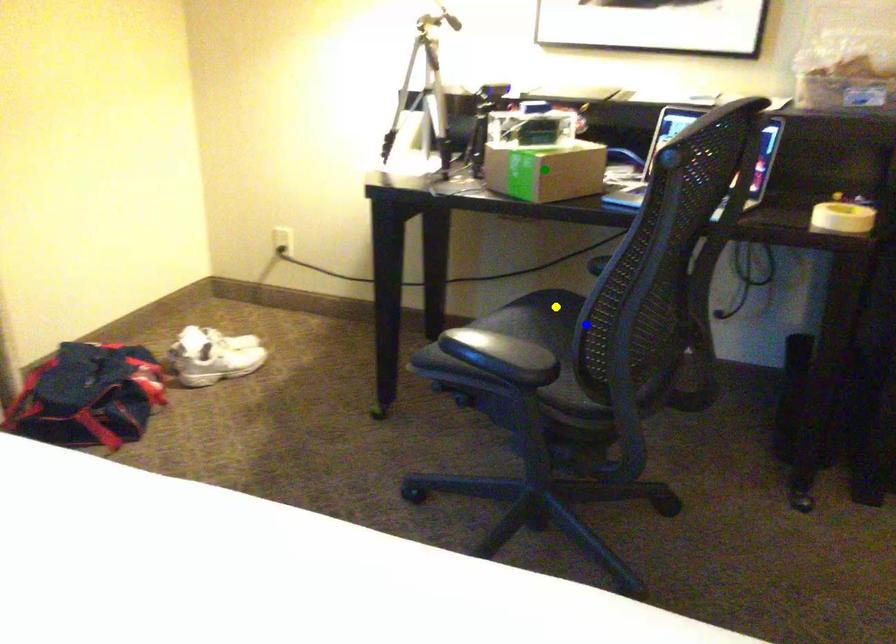
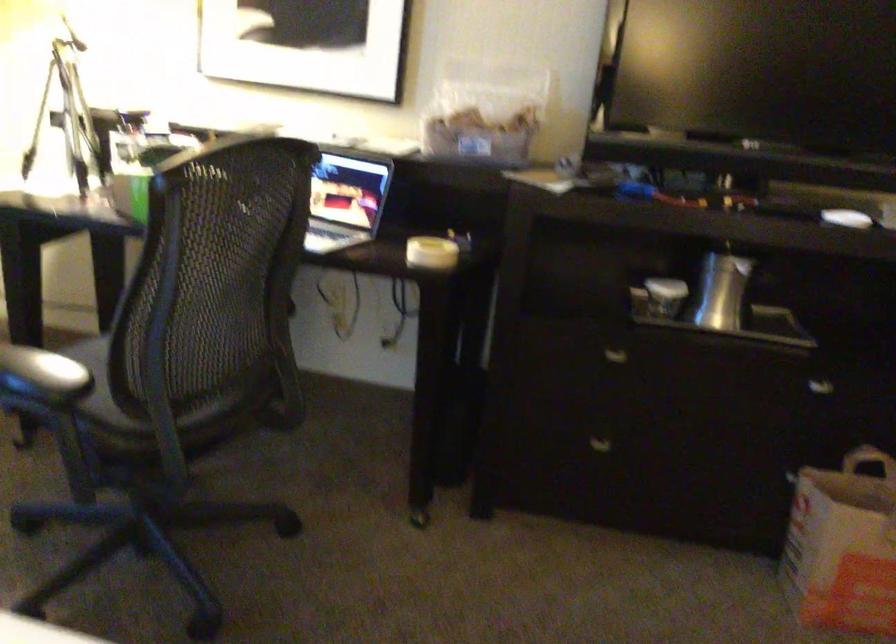
I am providing you with two images of the same scene from different viewpoints. Three points are marked in image1. Which point corresponds to a part or object that is occluded in image2?In image1, three points are marked. Which of them correspond to a part or object that is occluded in image2?Among the three points shown in image1, which one corresponds to a part or object that is no longer visible due to occlusion in image2?

yellow point, green point